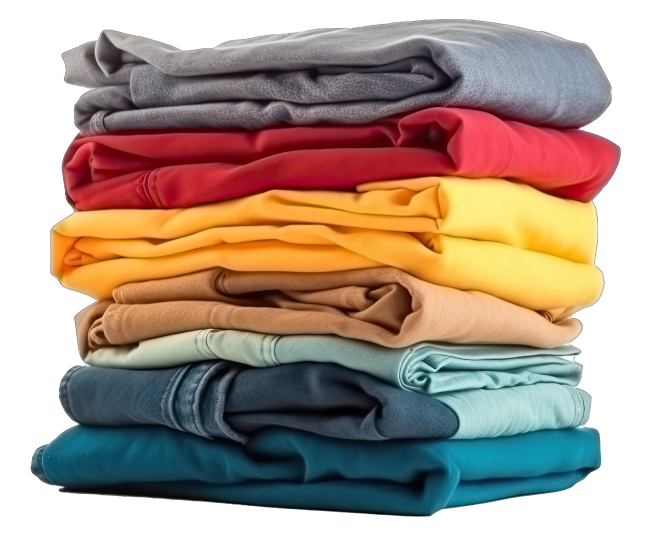
Locate an element on the screen. Image resolution: width=650 pixels, height=535 pixels. folded clothes is located at coordinates (338, 470), (338, 419), (346, 351), (370, 322), (383, 232), (374, 166), (400, 84).